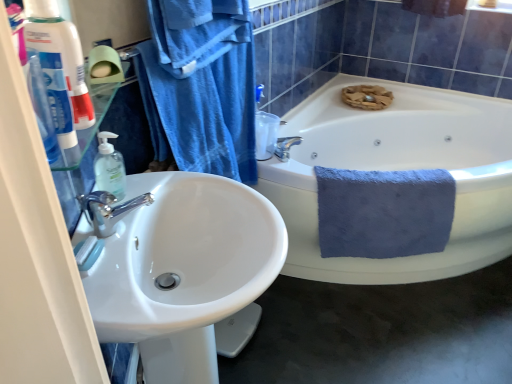
Question: Is white glossy toothpaste tube at left spatially inside white glossy sink at left, or outside of it?

Choices:
 (A) inside
 (B) outside

Answer: (B)

Question: From the image's perspective, relative to white glossy sink at left, is white glossy toothpaste tube at left above or below?

Choices:
 (A) below
 (B) above

Answer: (B)

Question: Considering the real-world distances, which object is farthest from the white ceramic bathtub at center?

Choices:
 (A) white glossy sink at left
 (B) clear plastic soap dispenser at left
 (C) blue cotton towel at upper left, the 2th bath towel viewed from the back
 (D) blue fluffy towel at right, placed as the 1th bath towel when sorted from back to front
 (E) white glossy toothpaste tube at left

Answer: (E)

Question: Estimate the real-world distances between objects in this image. Which object is closer to the blue fluffy towel at right, which is the 1th bath towel from right to left?

Choices:
 (A) clear plastic soap dispenser at left
 (B) blue cotton towel at upper left, the 2th bath towel viewed from the back
 (C) white glossy sink at left
 (D) white ceramic bathtub at center
 (E) white glossy toothpaste tube at left

Answer: (B)